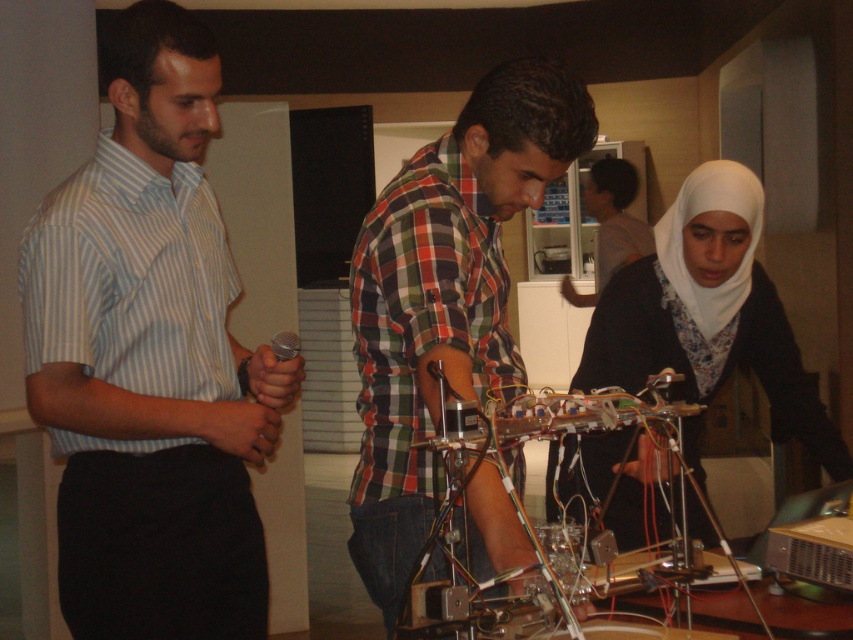
Who is positioned more to the left, checkered fabric shirt at center or white matte hijab at center?

checkered fabric shirt at center is more to the left.

Between checkered fabric shirt at center and white matte hijab at center, which one appears on the right side from the viewer's perspective?

white matte hijab at center

At what (x,y) coordinates should I click in order to perform the action: click on checkered fabric shirt at center. Please return your answer as a coordinate pair (x, y). The height and width of the screenshot is (640, 853). Looking at the image, I should click on (445, 298).

What do you see at coordinates (149, 358) in the screenshot? Image resolution: width=853 pixels, height=640 pixels. I see `light blue striped shirt at left` at bounding box center [149, 358].

Does light blue striped shirt at left appear on the left side of checkered fabric shirt at center?

Yes, light blue striped shirt at left is to the left of checkered fabric shirt at center.

Between point (195, 211) and point (483, 88), which one is positioned behind?

The point (195, 211) is more distant.

The image size is (853, 640). Find the location of `light blue striped shirt at left`. light blue striped shirt at left is located at coordinates (149, 358).

The height and width of the screenshot is (640, 853). I want to click on checkered fabric shirt at center, so click(x=445, y=298).

Who is more distant from viewer, (437, 225) or (625, 241)?

The point (625, 241) is behind.

Identify the location of checkered fabric shirt at center. The width and height of the screenshot is (853, 640). (445, 298).